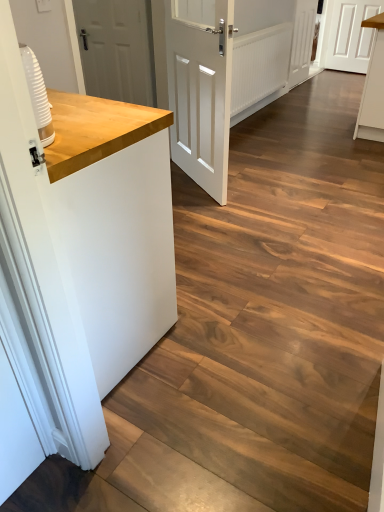
Question: Considering the relative sizes of wooden countertop at left and white wooden door at upper center, the third door in the front-to-back sequence, in the image provided, is wooden countertop at left shorter than white wooden door at upper center, the third door in the front-to-back sequence,?

Choices:
 (A) no
 (B) yes

Answer: (B)

Question: Is white wooden door at upper center, the second door from the back, surrounded by wooden countertop at left?

Choices:
 (A) yes
 (B) no

Answer: (B)

Question: Does wooden countertop at left have a greater width compared to white wooden door at upper center, positioned as the 2th door in right-to-left order?

Choices:
 (A) yes
 (B) no

Answer: (A)

Question: Does wooden countertop at left have a larger size compared to white wooden door at upper center, the third door in the front-to-back sequence?

Choices:
 (A) yes
 (B) no

Answer: (A)

Question: Is wooden countertop at left next to white wooden door at upper center, the second door from the back?

Choices:
 (A) no
 (B) yes

Answer: (A)

Question: From the image's perspective, would you say wooden countertop at left is shown under white wooden door at upper center, positioned as the 2th door in right-to-left order?

Choices:
 (A) no
 (B) yes

Answer: (B)

Question: Can you confirm if white matte cabinet at upper right is taller than wooden countertop at left?

Choices:
 (A) yes
 (B) no

Answer: (B)

Question: From a real-world perspective, does white matte cabinet at upper right stand above wooden countertop at left?

Choices:
 (A) yes
 (B) no

Answer: (B)

Question: Is white matte cabinet at upper right next to wooden countertop at left and touching it?

Choices:
 (A) yes
 (B) no

Answer: (B)

Question: Is the depth of white matte cabinet at upper right less than that of wooden countertop at left?

Choices:
 (A) yes
 (B) no

Answer: (B)

Question: Would you consider white matte cabinet at upper right to be distant from wooden countertop at left?

Choices:
 (A) yes
 (B) no

Answer: (A)

Question: Is white matte cabinet at upper right facing towards wooden countertop at left?

Choices:
 (A) yes
 (B) no

Answer: (A)

Question: Considering the relative positions of wooden countertop at left and white matte door at center, which appears as the 3th door when viewed from the right, in the image provided, is wooden countertop at left behind white matte door at center, which appears as the 3th door when viewed from the right,?

Choices:
 (A) no
 (B) yes

Answer: (A)